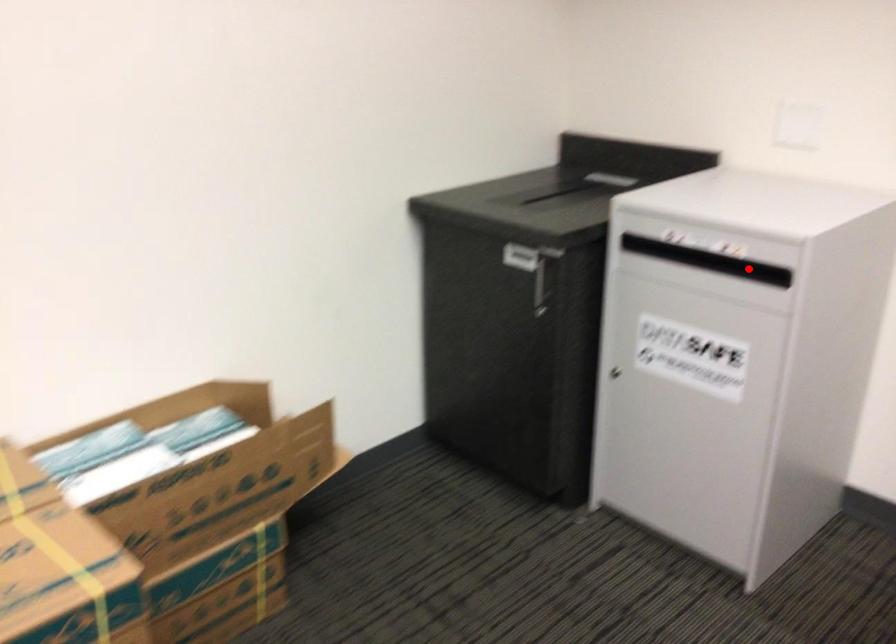
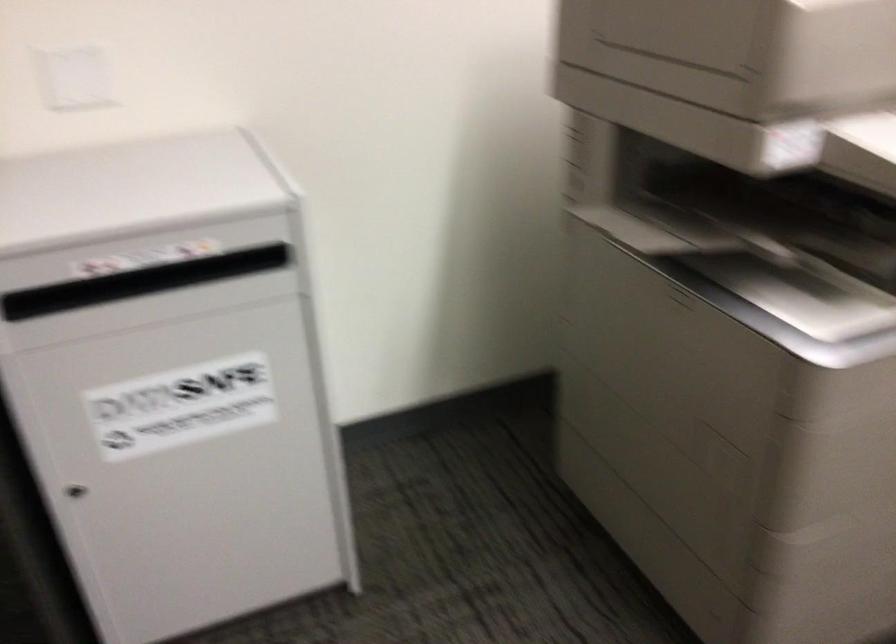
Question: I am providing you with two images of the same scene from different viewpoints. A red point is marked on the first image. Can you still see the location of the red point in image 2?

Choices:
 (A) Yes
 (B) No

Answer: (B)